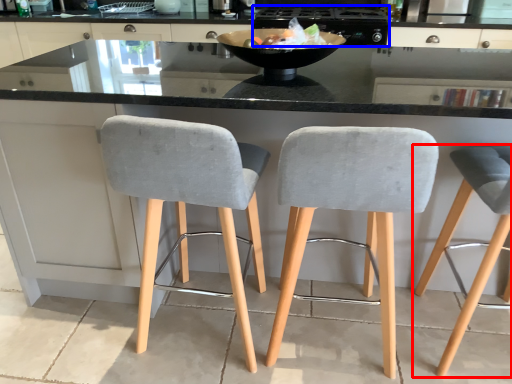
Question: Which of the following is the farthest to the observer, chair (highlighted by a red box) or appliance (highlighted by a blue box)?

Choices:
 (A) chair
 (B) appliance

Answer: (B)